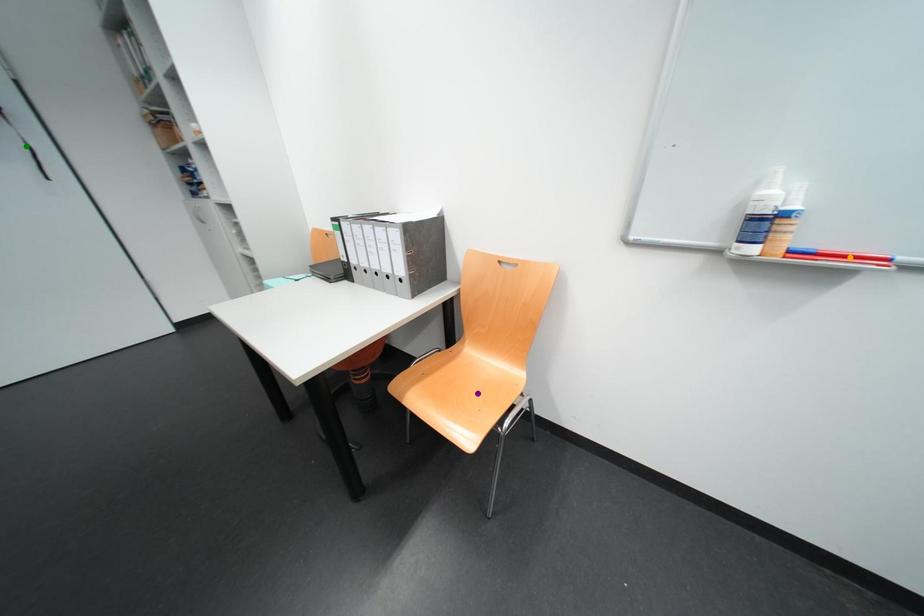
Order these from nearest to farthest:
purple point, orange point, green point

orange point, green point, purple point